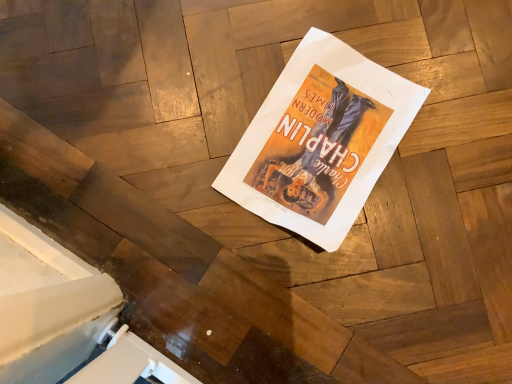
What do you see at coordinates (320, 140) in the screenshot? I see `matte paper poster at center` at bounding box center [320, 140].

Where is `matte paper poster at center`? Image resolution: width=512 pixels, height=384 pixels. matte paper poster at center is located at coordinates (320, 140).

Locate an element on the screen. This screenshot has height=384, width=512. matte paper poster at center is located at coordinates (320, 140).